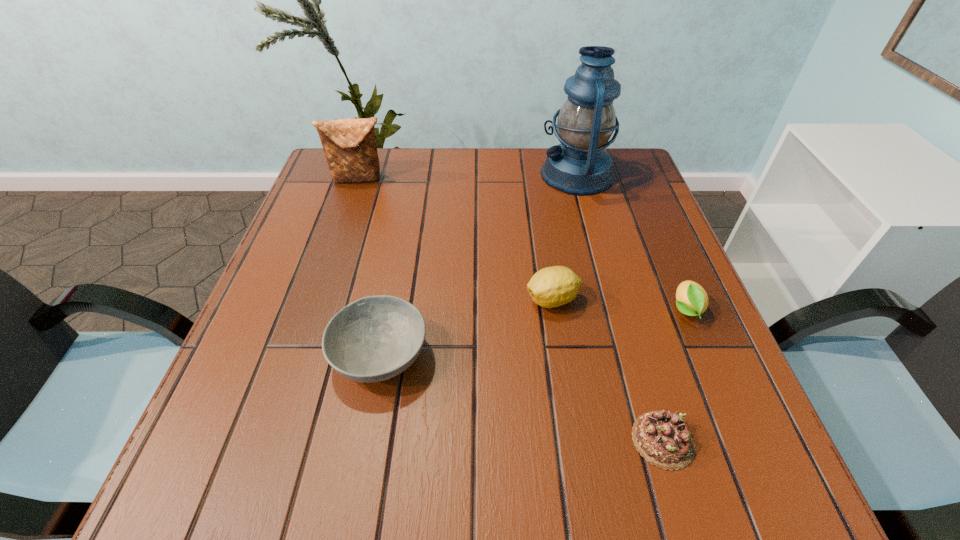
At what (x,y) coordinates should I click in order to perform the action: click on object that is positioned at the near edge. Please return your answer as a coordinate pair (x, y). Looking at the image, I should click on (662, 438).

This screenshot has height=540, width=960. Identify the location of object at the left edge. (349, 145).

This screenshot has width=960, height=540. I want to click on lantern that is at the right edge, so click(x=580, y=166).

Where is `lemon that is positioned at the right edge`? lemon that is positioned at the right edge is located at coordinates (691, 299).

You are a GUI agent. You are given a task and a screenshot of the screen. Output one action in this format:
    pyautogui.click(x=<x>, y=<y>)
    Task: Click on the chocolate cake that is at the right edge
    The width and height of the screenshot is (960, 540).
    Given the screenshot: What is the action you would take?
    pyautogui.click(x=662, y=438)

Identify the location of object that is at the far left corner. This screenshot has width=960, height=540. (349, 145).

Locate an element on the screen. object located at the far right corner is located at coordinates (580, 166).

At what (x,y) coordinates should I click in order to perform the action: click on object located at the near right corner. Please return your answer as a coordinate pair (x, y). Image resolution: width=960 pixels, height=540 pixels. Looking at the image, I should click on (662, 438).

In the image, there is a desktop. Where is `vacant space at the far edge`? vacant space at the far edge is located at coordinates (501, 182).

The image size is (960, 540). I want to click on vacant region at the near edge of the desktop, so click(x=541, y=456).